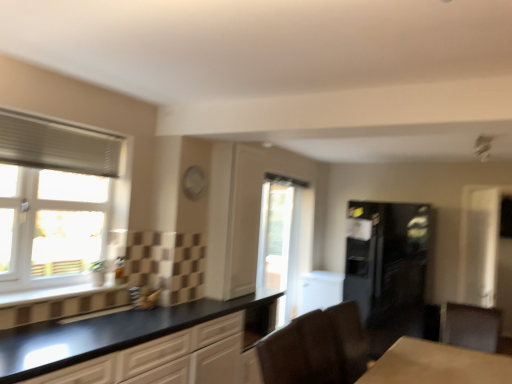
Question: Is white glossy screen door at right spatially inside transparent glass door at center, the first window viewed from the right, or outside of it?

Choices:
 (A) outside
 (B) inside

Answer: (A)

Question: Considering the positions of white glossy screen door at right and transparent glass door at center, acting as the 2th window starting from the left, in the image, is white glossy screen door at right taller or shorter than transparent glass door at center, acting as the 2th window starting from the left,?

Choices:
 (A) tall
 (B) short

Answer: (B)

Question: Estimate the real-world distances between objects in this image. Which object is closer to the brown leather armchair at lower center?

Choices:
 (A) black glossy refrigerator at right
 (B) matte black cabinet at lower right, which ranks as the 1th cabinetry in right-to-left order
 (C) black matte cabinet at lower left, which is the second cabinetry from right to left
 (D) white glossy screen door at right
 (E) white textured window at left, the 1th window when ordered from left to right

Answer: (C)

Question: Estimate the real-world distances between objects in this image. Which object is closer to the matte black cabinet at lower right, which ranks as the 1th cabinetry in right-to-left order?

Choices:
 (A) brown leather armchair at lower center
 (B) white textured window at left, the second window in the back-to-front sequence
 (C) white glossy screen door at right
 (D) black glossy refrigerator at right
 (E) transparent glass door at center, which appears as the first window when viewed from the back

Answer: (A)